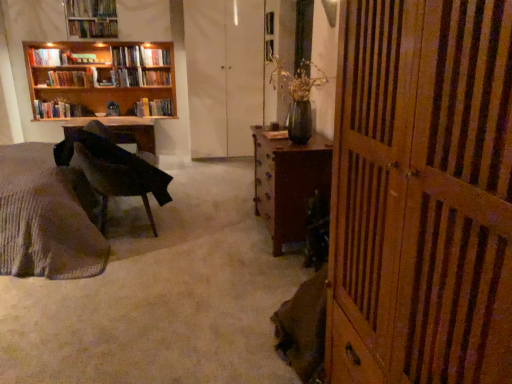
Question: Is knitted fabric bed at lower left not inside matte black table at left?

Choices:
 (A) no
 (B) yes

Answer: (B)

Question: Are knitted fabric bed at lower left and matte black table at left making contact?

Choices:
 (A) no
 (B) yes

Answer: (A)

Question: From a real-world perspective, is knitted fabric bed at lower left positioned over matte black table at left based on gravity?

Choices:
 (A) no
 (B) yes

Answer: (B)

Question: Considering the relative sizes of knitted fabric bed at lower left and matte black table at left in the image provided, is knitted fabric bed at lower left thinner than matte black table at left?

Choices:
 (A) no
 (B) yes

Answer: (A)

Question: Is knitted fabric bed at lower left aimed at matte black table at left?

Choices:
 (A) yes
 (B) no

Answer: (B)

Question: From the image's perspective, does knitted fabric bed at lower left appear lower than matte black table at left?

Choices:
 (A) yes
 (B) no

Answer: (A)

Question: From the image's perspective, is wooden bookshelf at upper left under hardcover books at left, acting as the seventh book starting from the top?

Choices:
 (A) yes
 (B) no

Answer: (B)

Question: Does wooden bookshelf at upper left come in front of hardcover books at left, acting as the seventh book starting from the top?

Choices:
 (A) yes
 (B) no

Answer: (A)

Question: Considering the relative sizes of wooden bookshelf at upper left and hardcover books at left, the 1th book positioned from the bottom, in the image provided, is wooden bookshelf at upper left bigger than hardcover books at left, the 1th book positioned from the bottom,?

Choices:
 (A) no
 (B) yes

Answer: (B)

Question: Is wooden bookshelf at upper left smaller than hardcover books at left, acting as the seventh book starting from the top?

Choices:
 (A) no
 (B) yes

Answer: (A)

Question: Can you confirm if wooden bookshelf at upper left is shorter than hardcover books at left, the 1th book positioned from the bottom?

Choices:
 (A) yes
 (B) no

Answer: (B)

Question: From a real-world perspective, is wooden bookshelf at upper left positioned under hardcover books at left, the 1th book positioned from the bottom, based on gravity?

Choices:
 (A) no
 (B) yes

Answer: (A)

Question: Does hardcover book at upper left, acting as the 3th book starting from the bottom, appear on the left side of white matte screen door at center, the 1th screen door from the left?

Choices:
 (A) no
 (B) yes

Answer: (B)